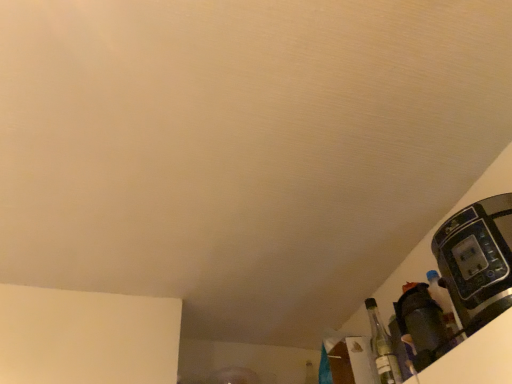
Question: Could matte black coffee maker at lower right be considered to be inside clear glass bottle at lower right?

Choices:
 (A) no
 (B) yes

Answer: (A)

Question: Does clear glass bottle at lower right turn towards matte black coffee maker at lower right?

Choices:
 (A) no
 (B) yes

Answer: (A)

Question: Is clear glass bottle at lower right positioned in front of matte black coffee maker at lower right?

Choices:
 (A) yes
 (B) no

Answer: (B)

Question: From the image's perspective, would you say clear glass bottle at lower right is shown under matte black coffee maker at lower right?

Choices:
 (A) no
 (B) yes

Answer: (B)

Question: Is clear glass bottle at lower right not close to matte black coffee maker at lower right?

Choices:
 (A) no
 (B) yes

Answer: (A)

Question: In terms of height, does black plastic coffee machine at right look taller or shorter compared to clear glass bottle at lower right?

Choices:
 (A) tall
 (B) short

Answer: (B)

Question: Based on their sizes in the image, would you say black plastic coffee machine at right is bigger or smaller than clear glass bottle at lower right?

Choices:
 (A) small
 (B) big

Answer: (B)

Question: Is black plastic coffee machine at right to the left or to the right of clear glass bottle at lower right in the image?

Choices:
 (A) right
 (B) left

Answer: (A)

Question: Is point (455, 299) closer or farther from the camera than point (371, 334)?

Choices:
 (A) farther
 (B) closer

Answer: (B)

Question: Is matte black coffee maker at lower right bigger or smaller than clear glass bottle at lower right?

Choices:
 (A) big
 (B) small

Answer: (A)

Question: In the image, is matte black coffee maker at lower right positioned in front of or behind clear glass bottle at lower right?

Choices:
 (A) behind
 (B) front

Answer: (B)

Question: Is point (408, 327) closer or farther from the camera than point (373, 324)?

Choices:
 (A) closer
 (B) farther

Answer: (A)

Question: In the image, is matte black coffee maker at lower right on the left side or the right side of clear glass bottle at lower right?

Choices:
 (A) left
 (B) right

Answer: (B)

Question: Is black plastic coffee machine at right bigger or smaller than matte black coffee maker at lower right?

Choices:
 (A) small
 (B) big

Answer: (B)

Question: Is black plastic coffee machine at right in front of or behind matte black coffee maker at lower right in the image?

Choices:
 (A) front
 (B) behind

Answer: (A)